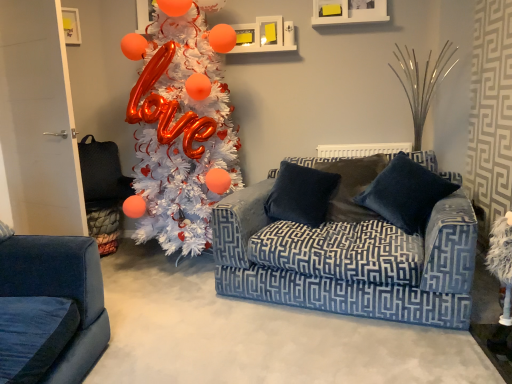
Question: Is velvet dark blue pillow at center, the 1th pillow in the left-to-right sequence, bigger than velvet dark blue pillow at center, which is the first pillow from right to left?

Choices:
 (A) no
 (B) yes

Answer: (A)

Question: Can you confirm if velvet dark blue pillow at center, the 1th pillow in the left-to-right sequence, is taller than velvet dark blue pillow at center, which is the first pillow from right to left?

Choices:
 (A) yes
 (B) no

Answer: (B)

Question: Is velvet dark blue pillow at center, the 1th pillow in the left-to-right sequence, smaller than velvet dark blue pillow at center, placed as the 2th pillow when sorted from left to right?

Choices:
 (A) yes
 (B) no

Answer: (A)

Question: Is velvet dark blue pillow at center, the 1th pillow in the left-to-right sequence, shorter than velvet dark blue pillow at center, placed as the 2th pillow when sorted from left to right?

Choices:
 (A) no
 (B) yes

Answer: (B)

Question: Can you confirm if velvet dark blue pillow at center, the 1th pillow in the left-to-right sequence, is positioned to the left of velvet dark blue pillow at center, placed as the 2th pillow when sorted from left to right?

Choices:
 (A) no
 (B) yes

Answer: (B)

Question: From the image's perspective, is white matte christmas tree at left located above or below velvet blue couch at center?

Choices:
 (A) above
 (B) below

Answer: (A)

Question: Considering the positions of white matte christmas tree at left and velvet blue couch at center in the image, is white matte christmas tree at left taller or shorter than velvet blue couch at center?

Choices:
 (A) short
 (B) tall

Answer: (B)

Question: From a real-world perspective, is white matte christmas tree at left physically located above or below velvet blue couch at center?

Choices:
 (A) below
 (B) above

Answer: (B)

Question: In the image, is white matte christmas tree at left on the left side or the right side of velvet blue couch at center?

Choices:
 (A) left
 (B) right

Answer: (A)

Question: From the image's perspective, relative to white matte christmas tree at left, is velvet dark blue pillow at center, placed as the 2th pillow when sorted from left to right, above or below?

Choices:
 (A) below
 (B) above

Answer: (A)

Question: From a real-world perspective, is velvet dark blue pillow at center, which is the first pillow from right to left, positioned above or below white matte christmas tree at left?

Choices:
 (A) above
 (B) below

Answer: (B)

Question: Looking at their shapes, would you say velvet dark blue pillow at center, placed as the 2th pillow when sorted from left to right, is wider or thinner than white matte christmas tree at left?

Choices:
 (A) wide
 (B) thin

Answer: (B)

Question: Choose the correct answer: Is velvet dark blue pillow at center, which is the first pillow from right to left, inside white matte christmas tree at left or outside it?

Choices:
 (A) outside
 (B) inside

Answer: (A)

Question: Is velvet dark blue pillow at center, which is the first pillow from right to left, bigger or smaller than velvet dark blue pillow at center, the 1th pillow in the left-to-right sequence?

Choices:
 (A) big
 (B) small

Answer: (A)

Question: Is point (417, 193) closer or farther from the camera than point (293, 185)?

Choices:
 (A) closer
 (B) farther

Answer: (A)